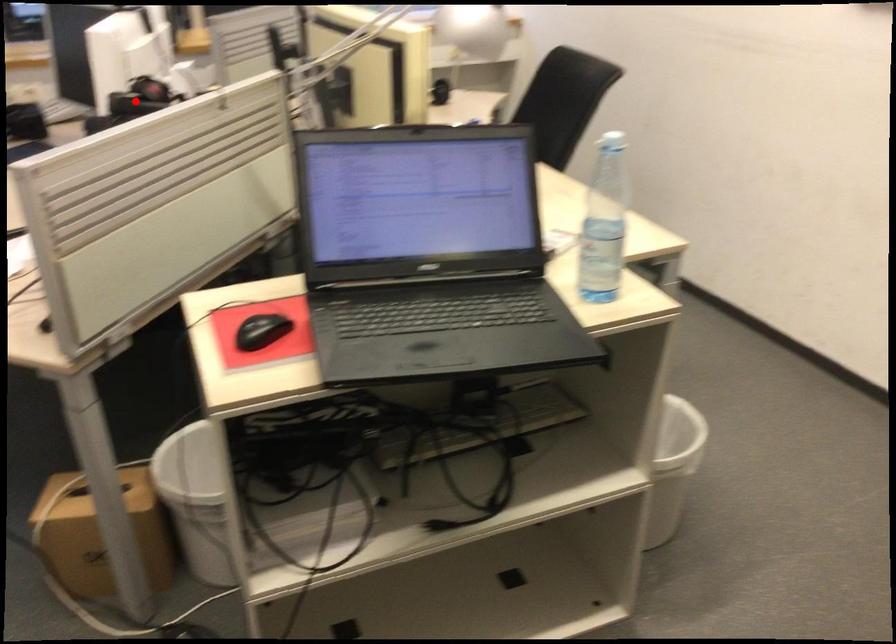
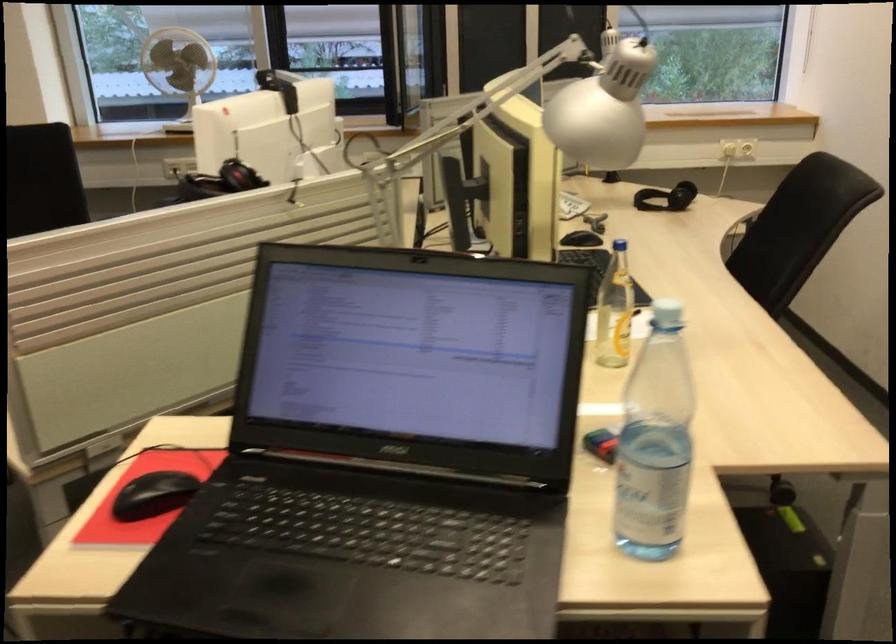
Locate, in the second image, the point that corresponds to the highlighted location in the first image.

(220, 182)